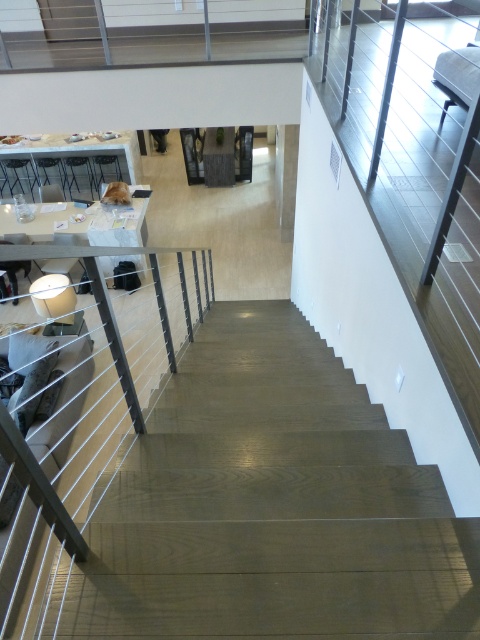
Looking at this image, you are a delivery person carrying a large package and need to move from the entrance to the dining area. You see the wooden stairs at center and the white glossy table at upper center. Which object should you avoid stepping on to ensure the package stays safe?

You should avoid stepping on the white glossy table at upper center because the wooden stairs at center are positioned on its right side, meaning the table is likely in a location where stepping on it would be unsafe for the package.

You are a delivery person entering the house and see the white glossy table at upper center and the dark brown leather jacket at upper center. You need to place a package on the table. Is there enough space on the table to place the package without moving the jacket?

The white glossy table at upper center is positioned under the dark brown leather jacket at upper center, meaning the jacket is hanging above the table. Since the jacket is not on the table itself, there is space to place the package on the table without moving the jacket.